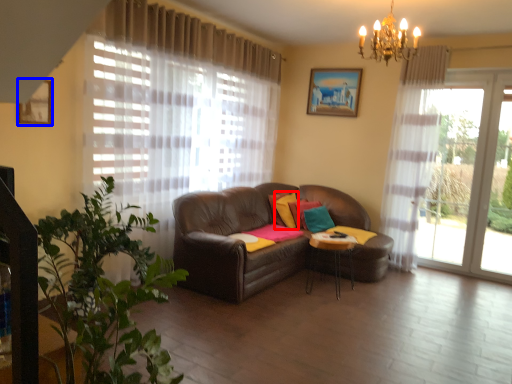
Question: Which of the following is the farthest to the observer, pillow (highlighted by a red box) or picture frame (highlighted by a blue box)?

Choices:
 (A) pillow
 (B) picture frame

Answer: (A)